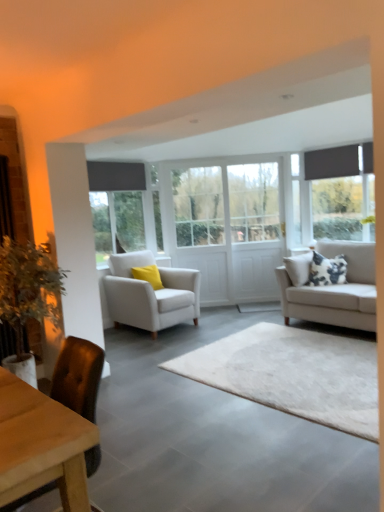
Question: Does light gray fabric couch at right have a smaller size compared to white soft rug at center?

Choices:
 (A) no
 (B) yes

Answer: (A)

Question: Could you tell me if light gray fabric couch at right is turned towards white soft rug at center?

Choices:
 (A) no
 (B) yes

Answer: (B)

Question: Is light gray fabric couch at right taller than white soft rug at center?

Choices:
 (A) yes
 (B) no

Answer: (A)

Question: Is light gray fabric couch at right directly adjacent to white soft rug at center?

Choices:
 (A) yes
 (B) no

Answer: (B)

Question: Is light gray fabric couch at right to the right of white soft rug at center from the viewer's perspective?

Choices:
 (A) no
 (B) yes

Answer: (B)

Question: Is brown leather chair at lower left, the 1th chair when ordered from front to back, taller or shorter than clear glass door at center, which is the first glass door from left to right?

Choices:
 (A) tall
 (B) short

Answer: (B)

Question: Looking at the image, does brown leather chair at lower left, the 2th chair viewed from the back, seem bigger or smaller compared to clear glass door at center, which is the first glass door from left to right?

Choices:
 (A) small
 (B) big

Answer: (A)

Question: Does point (87, 389) appear closer or farther from the camera than point (178, 241)?

Choices:
 (A) farther
 (B) closer

Answer: (B)

Question: In terms of width, does brown leather chair at lower left, the 2th chair viewed from the back, look wider or thinner when compared to clear glass door at center, which is the first glass door from left to right?

Choices:
 (A) wide
 (B) thin

Answer: (A)

Question: From a real-world perspective, relative to light gray fabric couch at right, is white soft rug at center vertically above or below?

Choices:
 (A) below
 (B) above

Answer: (A)

Question: In the image, is white soft rug at center on the left side or the right side of light gray fabric couch at right?

Choices:
 (A) right
 (B) left

Answer: (B)

Question: From the image's perspective, is white soft rug at center positioned above or below light gray fabric couch at right?

Choices:
 (A) above
 (B) below

Answer: (B)

Question: Considering the positions of white soft rug at center and light gray fabric couch at right in the image, is white soft rug at center wider or thinner than light gray fabric couch at right?

Choices:
 (A) thin
 (B) wide

Answer: (B)

Question: Would you say white wooden door at center, acting as the 2th window starting from the left, is inside or outside light gray fabric couch at right?

Choices:
 (A) inside
 (B) outside

Answer: (B)

Question: From a real-world perspective, relative to light gray fabric couch at right, is white wooden door at center, acting as the 2th window starting from the left, vertically above or below?

Choices:
 (A) above
 (B) below

Answer: (A)